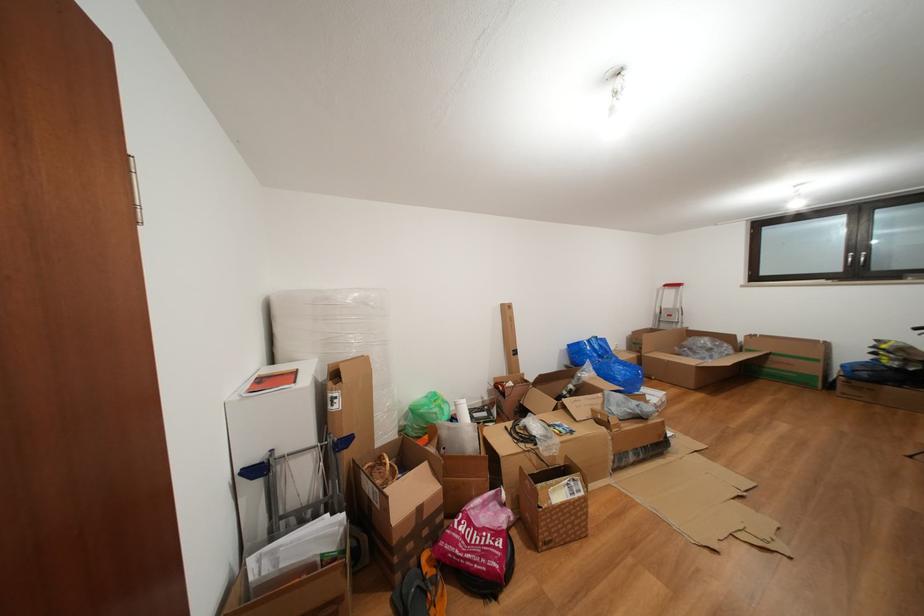
The height and width of the screenshot is (616, 924). What are the coordinates of `window handle` in the screenshot? It's located at (864, 259).